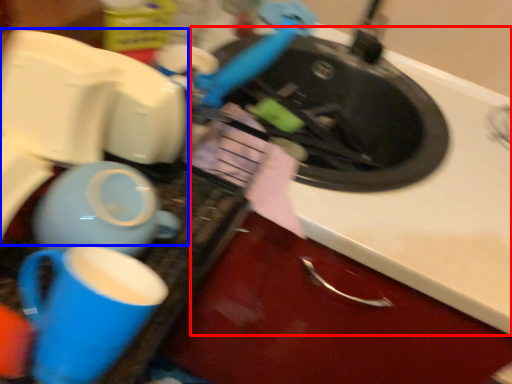
Question: Among these objects, which one is nearest to the camera, counter top (highlighted by a red box) or appliance (highlighted by a blue box)?

Choices:
 (A) counter top
 (B) appliance

Answer: (B)